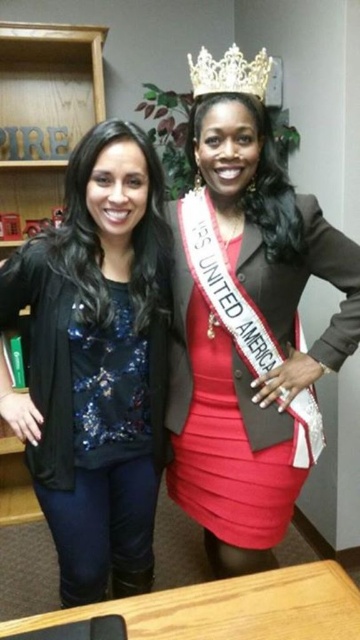
Is point (29, 518) positioned in front of point (262, 48)?

No, (29, 518) is behind (262, 48).

Between wooden bookshelf at left and gold metallic crown at upper center, which one has more height?

Standing taller between the two is wooden bookshelf at left.

Which is behind, point (6, 497) or point (245, 88)?

Positioned behind is point (6, 497).

Where is `wooden bookshelf at left`? The image size is (360, 640). wooden bookshelf at left is located at coordinates (45, 108).

Does satin red dress at center have a lesser height compared to wooden bookshelf at left?

No.

The width and height of the screenshot is (360, 640). Identify the location of satin red dress at center. tap(234, 346).

Can you confirm if sequined fabric top at center is positioned to the left of wooden bookshelf at left?

Incorrect, sequined fabric top at center is not on the left side of wooden bookshelf at left.

Can you confirm if sequined fabric top at center is positioned below wooden bookshelf at left?

Yes, sequined fabric top at center is below wooden bookshelf at left.

This screenshot has width=360, height=640. In order to click on sequined fabric top at center in this screenshot , I will do `click(96, 362)`.